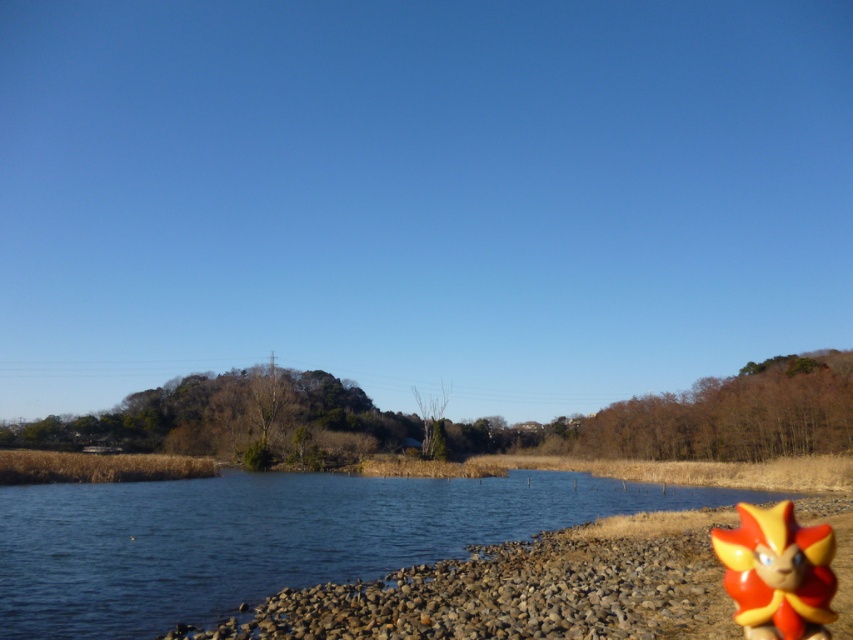
You are a child playing on the rocky shoreline and want to reach the shiny plastic toy at lower right without getting your shoes wet. Can you walk around the blue water at lower left to reach it?

The blue water at lower left is located below the shiny plastic toy at lower right, so the water is between you and the toy. To avoid getting your shoes wet, you need to walk around the blue water at lower left to reach the shiny plastic toy at lower right.

You are a photographer standing at the center of the rocky shoreline. You want to capture a photo that includes both the blue water at lower left and the shiny plastic toy at lower right. Which object will appear closer to the camera in the photo?

The blue water at lower left will appear closer to the camera in the photo because it is further to the viewer than the shiny plastic toy at lower right, meaning it is positioned nearer in the scene.